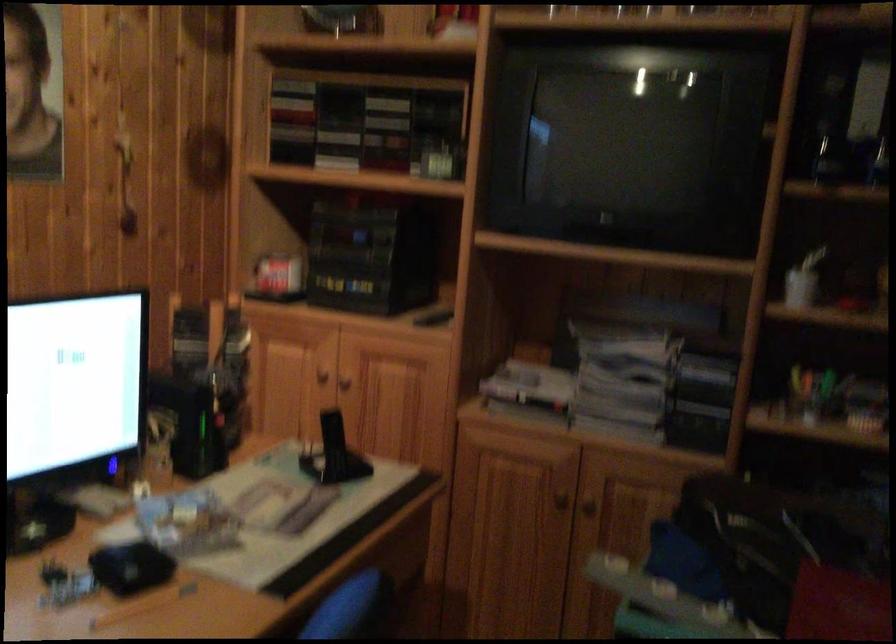
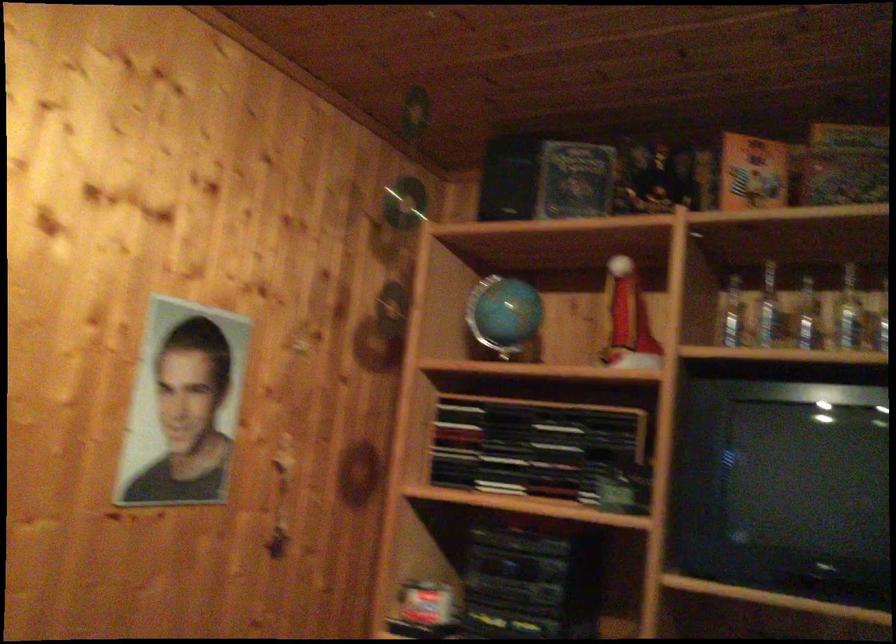
Where in the second image is the point corresponding to [407,129] from the first image?

(573, 446)